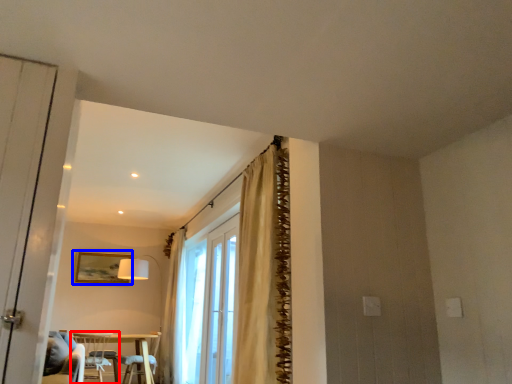
Question: Which point is further to the camera, chair (highlighted by a red box) or picture frame (highlighted by a blue box)?

Choices:
 (A) chair
 (B) picture frame

Answer: (B)